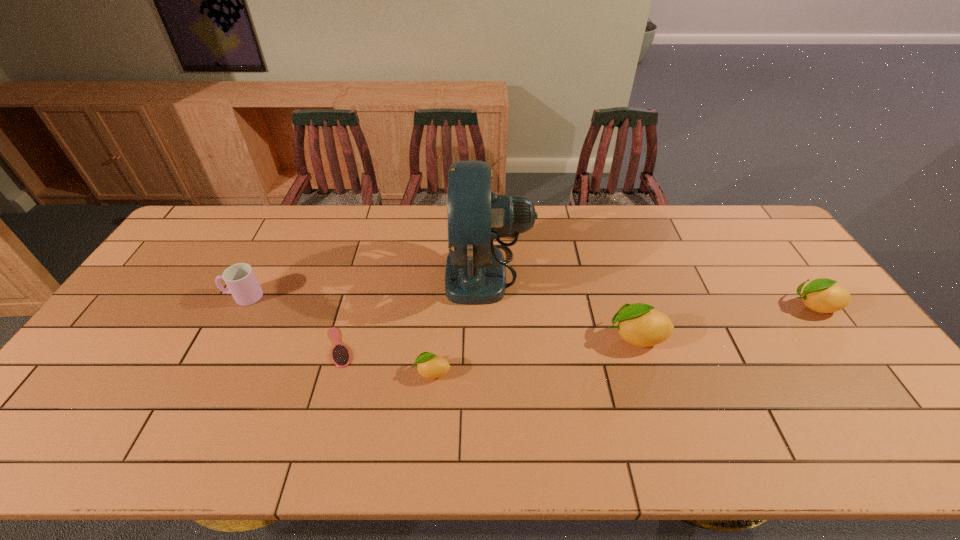
Locate an element on the screen. vacant region located with the handle on the side of the cup is located at coordinates (174, 296).

Identify the location of vacant space situated 0.170m with the handle on the side of the cup. (167, 296).

Image resolution: width=960 pixels, height=540 pixels. In order to click on free space located in front of the fan to blow air in this screenshot , I will do `click(424, 272)`.

Locate an element on the screen. The height and width of the screenshot is (540, 960). vacant space located 0.330m in front of the fan to blow air is located at coordinates (342, 272).

Image resolution: width=960 pixels, height=540 pixels. Identify the location of free region located 0.160m in front of the fan to blow air. click(396, 272).

I want to click on free space located 0.370m on the left of the second object from left to right, so click(x=187, y=347).

Locate an element on the screen. The height and width of the screenshot is (540, 960). object present at the far edge is located at coordinates (475, 274).

Find the location of a particular element. The image size is (960, 540). object positioned at the near edge is located at coordinates (431, 366).

Locate an element on the screen. The width and height of the screenshot is (960, 540). object present at the right edge is located at coordinates (822, 295).

At what (x,y) coordinates should I click in order to perform the action: click on vacant area at the far edge of the desktop. Please return your answer as a coordinate pair (x, y). This screenshot has height=540, width=960. Looking at the image, I should click on (381, 220).